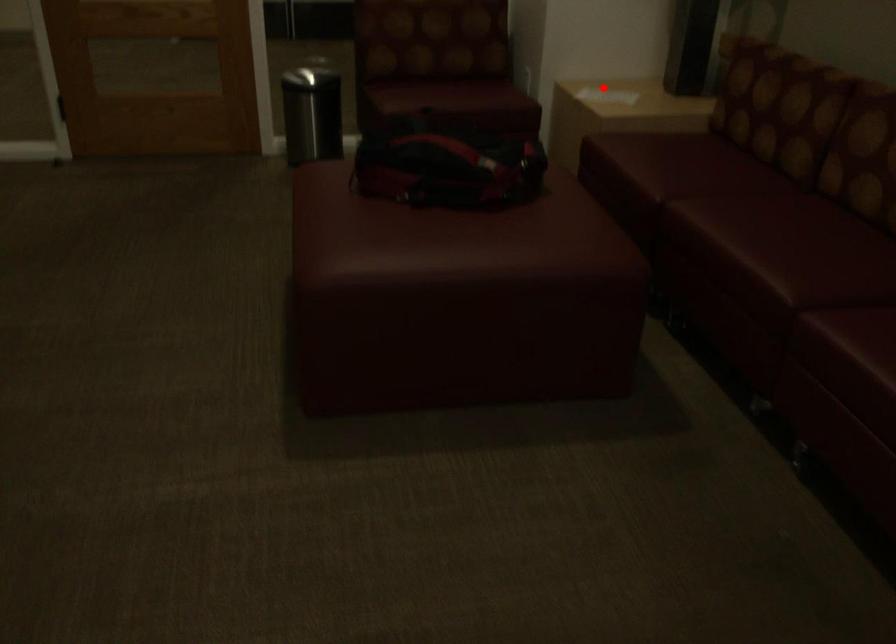
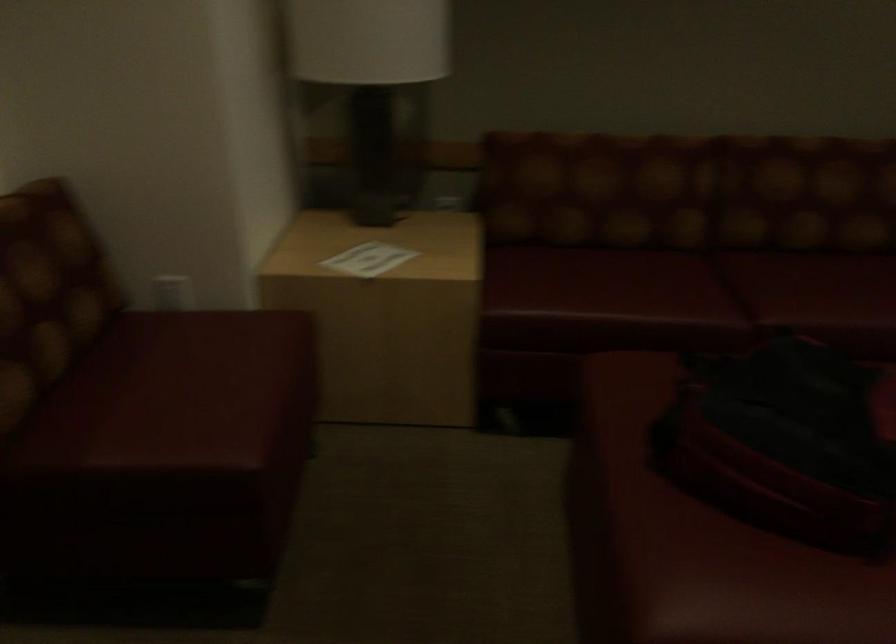
Question: A red point is marked in image1. In image2, is the corresponding 3D point closer to the camera or farther? Reply with the corresponding letter.

Choices:
 (A) The corresponding 3D point is closer.
 (B) The corresponding 3D point is farther.

Answer: (A)